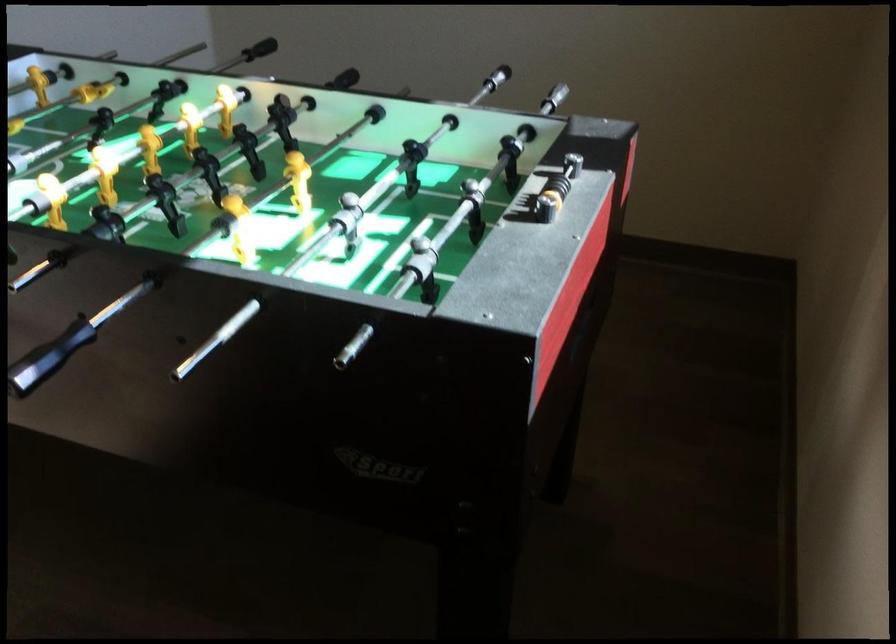
Where would you slid the scoring beads? Please return your answer as a coordinate pair (x, y).

(556, 185)